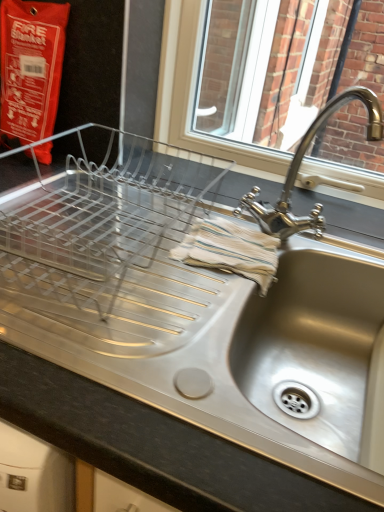
Measure the distance between point [252,492] and camera.

Point [252,492] and camera are 13.58 inches apart from each other.

This screenshot has height=512, width=384. What do you see at coordinates (153, 445) in the screenshot?
I see `satin steel sink at center` at bounding box center [153, 445].

Describe the element at coordinates (313, 346) in the screenshot. I see `stainless steel sink at lower right` at that location.

Locate an element on the screen. Image resolution: width=384 pixels, height=512 pixels. satin steel sink at center is located at coordinates (153, 445).

Who is shorter, polished chrome faucet at upper right or satin steel sink at center?

polished chrome faucet at upper right.

What's the angular difference between polished chrome faucet at upper right and satin steel sink at center's facing directions?

The facing directions of polished chrome faucet at upper right and satin steel sink at center are 1.2 degrees apart.

Can we say polished chrome faucet at upper right lies outside satin steel sink at center?

Yes.

Is satin steel sink at center facing towards stainless steel sink at lower right?

No, satin steel sink at center is not oriented towards stainless steel sink at lower right.

Choose the correct answer: Is satin steel sink at center inside stainless steel sink at lower right or outside it?

satin steel sink at center is not enclosed by stainless steel sink at lower right.

Looking at the image, does satin steel sink at center seem bigger or smaller compared to stainless steel sink at lower right?

Clearly, satin steel sink at center is larger in size than stainless steel sink at lower right.

Considering the relative sizes of satin steel sink at center and stainless steel sink at lower right in the image provided, is satin steel sink at center shorter than stainless steel sink at lower right?

In fact, satin steel sink at center may be taller than stainless steel sink at lower right.

Could you tell me if stainless steel sink at lower right is facing polished chrome faucet at upper right?

No.

From the image's perspective, which object appears higher, stainless steel sink at lower right or polished chrome faucet at upper right?

polished chrome faucet at upper right, from the image's perspective.

How different are the orientations of stainless steel sink at lower right and polished chrome faucet at upper right in degrees?

0.00107 degrees.

This screenshot has height=512, width=384. What are the coordinates of `tap above the stainless steel sink at lower right (from the image's perspective)` in the screenshot? It's located at pos(299,167).

From a real-world perspective, is polished chrome faucet at upper right located beneath stainless steel sink at lower right?

No, from a real-world perspective, polished chrome faucet at upper right is not beneath stainless steel sink at lower right.

Where is `tap that appears behind the stainless steel sink at lower right`? This screenshot has width=384, height=512. tap that appears behind the stainless steel sink at lower right is located at coordinates (299, 167).

Could you tell me if polished chrome faucet at upper right is facing stainless steel sink at lower right?

A: No, polished chrome faucet at upper right is not aimed at stainless steel sink at lower right.

Which is behind, point (377, 127) or point (267, 379)?

The point (377, 127) is farther from the camera.

Between point (51, 411) and point (292, 168), which one is positioned behind?

The point (292, 168) is farther.

From the image's perspective, relative to polished chrome faucet at upper right, is satin steel sink at center above or below?

Clearly, from the image's perspective, satin steel sink at center is below polished chrome faucet at upper right.

From a real-world perspective, is satin steel sink at center physically located above or below polished chrome faucet at upper right?

satin steel sink at center is below polished chrome faucet at upper right.

Based on their positions, is satin steel sink at center located to the left or right of polished chrome faucet at upper right?

satin steel sink at center is to the left of polished chrome faucet at upper right.

From the image's perspective, is stainless steel sink at lower right on satin steel sink at center?

Yes, from the image's perspective, stainless steel sink at lower right is over satin steel sink at center.

Does stainless steel sink at lower right have a lesser width compared to satin steel sink at center?

Correct, the width of stainless steel sink at lower right is less than that of satin steel sink at center.

Based on the photo, does stainless steel sink at lower right turn towards satin steel sink at center?

Yes, stainless steel sink at lower right is oriented towards satin steel sink at center.

Does stainless steel sink at lower right have a lesser height compared to satin steel sink at center?

Indeed, stainless steel sink at lower right has a lesser height compared to satin steel sink at center.

Find the location of a particular element. The image size is (384, 512). tap located above the satin steel sink at center (from the image's perspective) is located at coordinates (299, 167).

At what (x,y) coordinates should I click in order to perform the action: click on counter top located underneath the stainless steel sink at lower right (from a real-world perspective). Please return your answer as a coordinate pair (x, y). Looking at the image, I should click on (153, 445).

Considering their positions, is satin steel sink at center positioned further to stainless steel sink at lower right than polished chrome faucet at upper right?

The object further to stainless steel sink at lower right is satin steel sink at center.

Considering their positions, is polished chrome faucet at upper right positioned closer to stainless steel sink at lower right than satin steel sink at center?

Among the two, polished chrome faucet at upper right is located nearer to stainless steel sink at lower right.

Looking at the image, which one is located closer to satin steel sink at center, polished chrome faucet at upper right or stainless steel sink at lower right?

Among the two, stainless steel sink at lower right is located nearer to satin steel sink at center.

Considering their positions, is stainless steel sink at lower right positioned further to polished chrome faucet at upper right than satin steel sink at center?

Among the two, satin steel sink at center is located further to polished chrome faucet at upper right.

From the image, which object appears to be farther from polished chrome faucet at upper right, satin steel sink at center or stainless steel sink at lower right?

satin steel sink at center is further to polished chrome faucet at upper right.

When comparing their distances from satin steel sink at center, does stainless steel sink at lower right or polished chrome faucet at upper right seem further?

polished chrome faucet at upper right.

Image resolution: width=384 pixels, height=512 pixels. What are the coordinates of `sink between polished chrome faucet at upper right and satin steel sink at center from top to bottom` in the screenshot? It's located at (313, 346).